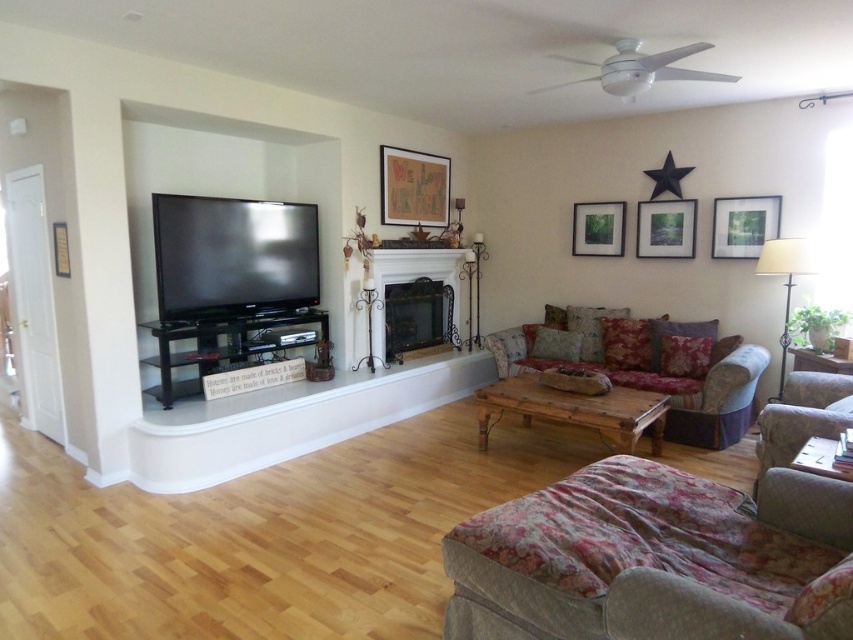
You are an interior designer planning to hang a new artwork in this living room. You notice the wooden framed map at upper center and the matte wooden picture frame at upper right. Which one is bigger in size?

The wooden framed map at upper center is larger in size compared to the matte wooden picture frame at upper right.

You are a delivery person who needs to place a package that is 2 meters long between the floral fabric ottoman at lower right and the matte wooden picture frame at upper center. Is there enough space to fit the package horizontally between these two objects?

The distance between the floral fabric ottoman at lower right and the matte wooden picture frame at upper center is 3.58 meters. Since the package is 2 meters long, there is sufficient space to fit it horizontally between these two objects.